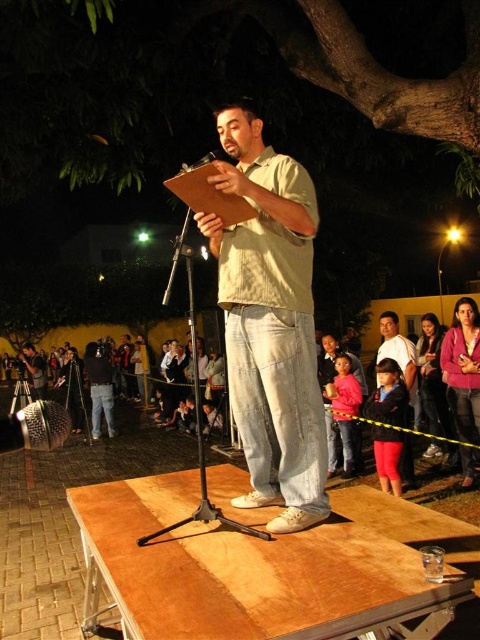
You are a photographer at the event and want to capture a photo of both the matte pink sweater at center and the black fabric dress at lower left without any obstruction. Which one should you focus on first to ensure both are visible?

The matte pink sweater at center is in front of the black fabric dress at lower left, so you should focus on the black fabric dress at lower left first to ensure both are visible without obstruction.

From the picture: You are a photographer positioned at the camera. You want to capture a closeup shot of the matte pink sweater at center. Given that your camera can focus on objects within 5 meters, will you be able to take the photo?

The matte pink sweater at center is 6.25 meters away from the camera, which is beyond the camera focus range of 5 meters. Therefore, you cannot take a closeup shot of the matte pink sweater at center with the current camera settings.